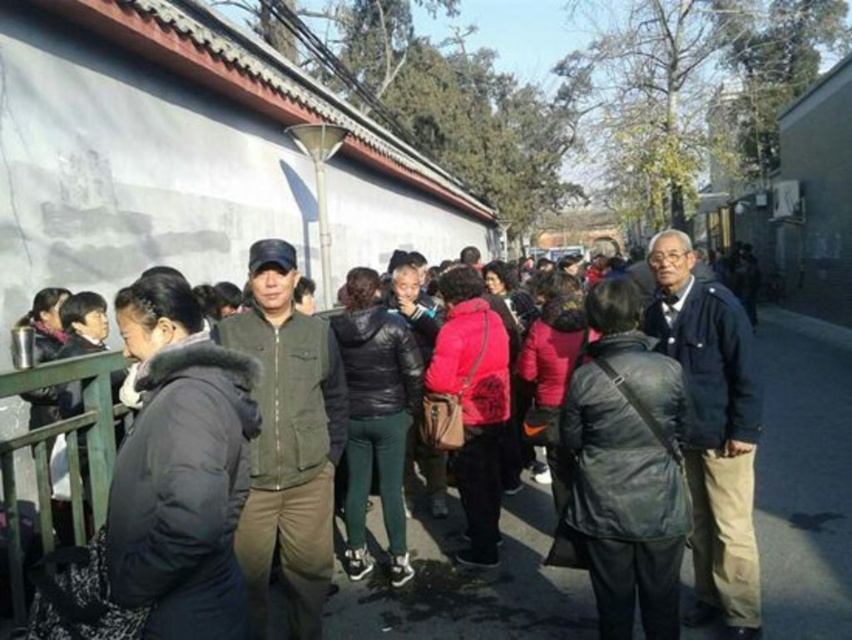
You are a photographer trying to capture both the dark gray jacket at center and the dark green jacket at center in a single frame. Since you want both to be clearly visible, which jacket should you focus on to ensure the smaller one is still in focus?

You should focus on the dark green jacket at center because it is smaller, ensuring both jackets remain in focus as the dark gray jacket at center is larger and will naturally be more in frame.